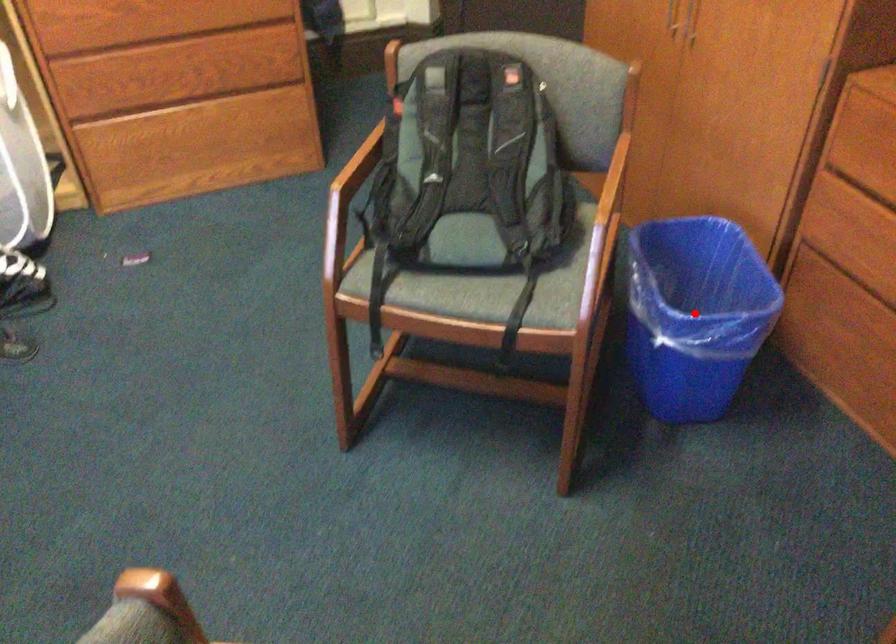
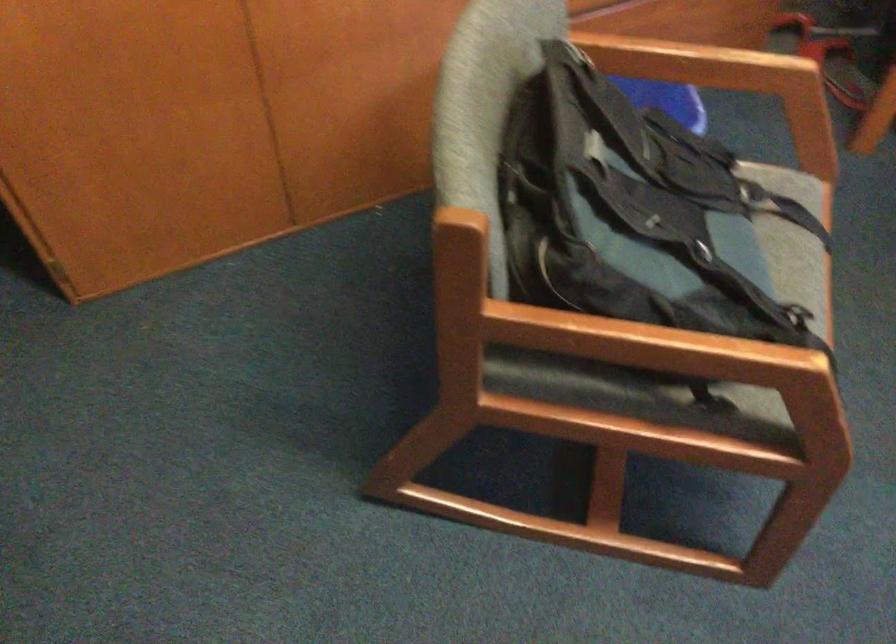
Question: I am providing you with two images of the same scene from different viewpoints. A red point is marked on the first image. At the location where the point appears in image 1, is it still visible in image 2?

Choices:
 (A) Yes
 (B) No

Answer: (B)